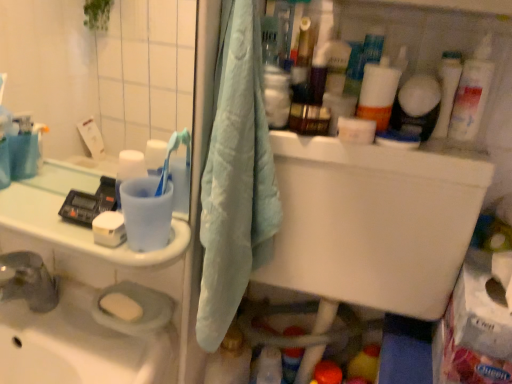
What do you see at coordinates (447, 89) in the screenshot? This screenshot has height=384, width=512. I see `white plastic tube at upper right` at bounding box center [447, 89].

Identify the location of green plastic toothbrush at upper left. (170, 155).

Find the location of a particular element. light blue fabric towel at center is located at coordinates (234, 176).

The width and height of the screenshot is (512, 384). Describe the element at coordinates (71, 223) in the screenshot. I see `white glossy cup at left` at that location.

The height and width of the screenshot is (384, 512). Find the location of `white plastic tube at upper right`. white plastic tube at upper right is located at coordinates (447, 89).

Image resolution: width=512 pixels, height=384 pixels. Identify the location of counter top lying above the white matte soap at left, the 1th soap when ordered from front to back (from the image's perspective). (71, 223).

Between white matte soap at left, the 1th soap when ordered from front to back, and white glossy cup at left, which one has more height?

Standing taller between the two is white matte soap at left, the 1th soap when ordered from front to back.

From a real-world perspective, between white matte soap at left, the second soap viewed from the back, and white glossy cup at left, who is vertically higher?

white matte soap at left, the second soap viewed from the back.

Looking at the image, does white matte soap at left, the 1th soap when ordered from top to bottom, seem bigger or smaller compared to white glossy cup at left?

In the image, white matte soap at left, the 1th soap when ordered from top to bottom, appears to be smaller than white glossy cup at left.

Which object is further away from the camera taking this photo, yellow matte soap at lower left, the first soap positioned from the back, or white glossy cup at left?

yellow matte soap at lower left, the first soap positioned from the back.

From a real-world perspective, which is physically below, yellow matte soap at lower left, which is the second soap from top to bottom, or white glossy cup at left?

From a 3D spatial view, yellow matte soap at lower left, which is the second soap from top to bottom, is below.

Consider the image. From the image's perspective, is yellow matte soap at lower left, which appears as the 1th soap when ordered from the bottom, located beneath white glossy cup at left?

Correct, yellow matte soap at lower left, which appears as the 1th soap when ordered from the bottom, appears lower than white glossy cup at left in the image.

Is yellow matte soap at lower left, the first soap positioned from the back, spatially inside white glossy cup at left, or outside of it?

yellow matte soap at lower left, the first soap positioned from the back, is not enclosed by white glossy cup at left.

In the image, is white glossy soap at lower left on the left side or the right side of white matte soap at left, the 1th soap when ordered from front to back?

In the image, white glossy soap at lower left appears on the left side of white matte soap at left, the 1th soap when ordered from front to back.

Is white matte soap at left, the second soap viewed from the back, located within white glossy soap at lower left?

No, white matte soap at left, the second soap viewed from the back, is not surrounded by white glossy soap at lower left.

Considering the sizes of objects white glossy soap at lower left and white matte soap at left, the second soap viewed from the back, in the image provided, who is taller, white glossy soap at lower left or white matte soap at left, the second soap viewed from the back,?

white glossy soap at lower left.

Where is `sink in front of the white matte soap at left, the 1th soap when ordered from front to back`? sink in front of the white matte soap at left, the 1th soap when ordered from front to back is located at coordinates (79, 345).

From a real-world perspective, starting from the white plastic tube at upper right, which cleaning product is the 2nd one below it? Please provide its 2D coordinates.

[(230, 360)]

From the image's perspective, is translucent plastic bottle at lower center, placed as the first cleaning product when sorted from bottom to top, above or below white plastic tube at upper right?

From the image's perspective, translucent plastic bottle at lower center, placed as the first cleaning product when sorted from bottom to top, appears below white plastic tube at upper right.

Which is correct: translucent plastic bottle at lower center, marked as the 3th cleaning product in a right-to-left arrangement, is inside white plastic tube at upper right, or outside of it?

translucent plastic bottle at lower center, marked as the 3th cleaning product in a right-to-left arrangement, is located beyond the bounds of white plastic tube at upper right.

From a real-world perspective, is light blue fabric towel at center positioned above or below translucent plastic bottle at lower center, marked as the 3th cleaning product in a right-to-left arrangement?

Clearly, from a real-world perspective, light blue fabric towel at center is above translucent plastic bottle at lower center, marked as the 3th cleaning product in a right-to-left arrangement.

Considering the sizes of objects light blue fabric towel at center and translucent plastic bottle at lower center, marked as the 3th cleaning product in a right-to-left arrangement, in the image provided, who is wider, light blue fabric towel at center or translucent plastic bottle at lower center, marked as the 3th cleaning product in a right-to-left arrangement,?

light blue fabric towel at center.

Between light blue fabric towel at center and translucent plastic bottle at lower center, marked as the 3th cleaning product in a right-to-left arrangement, which one appears on the right side from the viewer's perspective?

From the viewer's perspective, light blue fabric towel at center appears more on the right side.

Is light blue fabric towel at center smaller than translucent plastic bottle at lower center, marked as the 3th cleaning product in a right-to-left arrangement?

Actually, light blue fabric towel at center might be larger than translucent plastic bottle at lower center, marked as the 3th cleaning product in a right-to-left arrangement.

Is white glossy cup at left taller than white glossy soap at lower left?

Incorrect, the height of white glossy cup at left is not larger of that of white glossy soap at lower left.

Are white glossy cup at left and white glossy soap at lower left making contact?

No, white glossy cup at left is not touching white glossy soap at lower left.

From the image's perspective, relative to white glossy soap at lower left, is white glossy cup at left above or below?

Based on their image positions, white glossy cup at left is located above white glossy soap at lower left.

From a real-world perspective, between white glossy cup at left and white glossy soap at lower left, who is vertically lower?

From a 3D spatial view, white glossy soap at lower left is below.

Is white matte soap at left, the 1th soap when ordered from top to bottom, beside light blue fabric towel at center?

white matte soap at left, the 1th soap when ordered from top to bottom, and light blue fabric towel at center are not in contact.

Considering the relative positions of white matte soap at left, the second soap viewed from the back, and light blue fabric towel at center in the image provided, is white matte soap at left, the second soap viewed from the back, behind light blue fabric towel at center?

Yes, white matte soap at left, the second soap viewed from the back, is behind light blue fabric towel at center.

In the scene shown: Does white matte soap at left, which ranks as the 2th soap in bottom-to-top order, turn towards light blue fabric towel at center?

No, white matte soap at left, which ranks as the 2th soap in bottom-to-top order, is not facing towards light blue fabric towel at center.

How different are the orientations of white matte soap at left, the 1th soap when ordered from top to bottom, and light blue fabric towel at center in degrees?

There is a 1.92-degree angle between the facing directions of white matte soap at left, the 1th soap when ordered from top to bottom, and light blue fabric towel at center.

Locate an element on the screen. This screenshot has height=384, width=512. counter top below the white matte soap at left, the second soap viewed from the back (from a real-world perspective) is located at coordinates (71, 223).

Find the location of `counter top on the left of the yellow matte soap at lower left, which appears as the 1th soap when ordered from the bottom`. counter top on the left of the yellow matte soap at lower left, which appears as the 1th soap when ordered from the bottom is located at coordinates (71, 223).

Which object lies further to the anchor point translucent plastic bottle at lower center, marked as the 3th cleaning product in a right-to-left arrangement, white plastic tube at upper right or white glossy soap at lower left?

white plastic tube at upper right is further to translucent plastic bottle at lower center, marked as the 3th cleaning product in a right-to-left arrangement.

From the image, which object appears to be farther from white glossy cup at left, translucent plastic bottle at upper right, which is counted as the 2th cleaning product, starting from the right, or translucent plastic bottle at lower center, positioned as the first cleaning product in left-to-right order?

translucent plastic bottle at upper right, which is counted as the 2th cleaning product, starting from the right, is further to white glossy cup at left.

From the image, which object appears to be farther from translucent plastic bottle at upper right, marked as the second cleaning product in a left-to-right arrangement, yellow matte soap at lower left, the 2th soap from the front, or light blue fabric towel at center?

Based on the image, yellow matte soap at lower left, the 2th soap from the front, appears to be further to translucent plastic bottle at upper right, marked as the second cleaning product in a left-to-right arrangement.

Considering their positions, is light blue fabric towel at center positioned further to white plastic tube at upper right than translucent plastic bottle at upper right, placed as the 2th cleaning product when sorted from top to bottom?

light blue fabric towel at center.

Based on their spatial positions, is green plastic toothbrush at upper left or white matte soap at left, the 1th soap when ordered from top to bottom, closer to yellow matte soap at lower left, which appears as the 1th soap when ordered from the bottom?

white matte soap at left, the 1th soap when ordered from top to bottom.

Looking at the image, which one is located further to white glossy soap at lower left, green plastic toothbrush at upper left or translucent plastic bottle at upper right, marked as the second cleaning product in a left-to-right arrangement?

translucent plastic bottle at upper right, marked as the second cleaning product in a left-to-right arrangement, is further to white glossy soap at lower left.

When comparing their distances from white glossy cup at left, does white matte soap at left, the second soap viewed from the back, or white glossy soap at lower left seem closer?

Among the two, white matte soap at left, the second soap viewed from the back, is located nearer to white glossy cup at left.

Which object lies nearer to the anchor point light blue fabric towel at center, white glossy soap at lower left or white matte soap at left, the second soap viewed from the back?

white matte soap at left, the second soap viewed from the back.

Locate an element on the screen. toothbrush that lies between translucent plastic bottle at upper right, placed as the 2th cleaning product when sorted from top to bottom, and translucent plastic bottle at lower center, marked as the 3th cleaning product in a right-to-left arrangement, from top to bottom is located at coordinates (170, 155).

Locate an element on the screen. The image size is (512, 384). toiletry between yellow matte soap at lower left, which appears as the 1th soap when ordered from the bottom, and white glossy lotion at upper right, the third cleaning product viewed from the left is located at coordinates (447, 89).

Where is `toothbrush between white plastic tube at upper right and translucent plastic bottle at lower center, marked as the 3th cleaning product in a right-to-left arrangement, in the vertical direction`? The image size is (512, 384). toothbrush between white plastic tube at upper right and translucent plastic bottle at lower center, marked as the 3th cleaning product in a right-to-left arrangement, in the vertical direction is located at coordinates (170, 155).

What are the coordinates of `bath towel situated between white glossy cup at left and white plastic tube at upper right from left to right` in the screenshot? It's located at (234, 176).